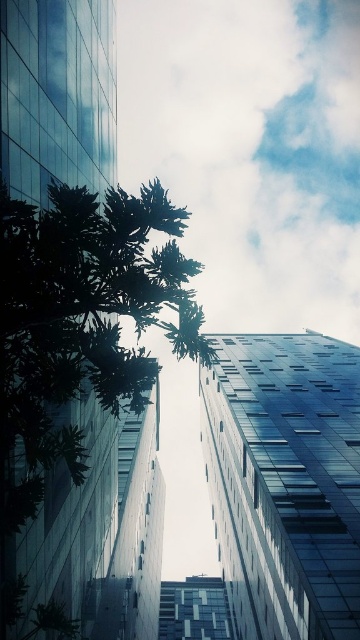
Who is shorter, white fluffy cloud at upper center or green leafy tree at center?

green leafy tree at center is shorter.

Between white fluffy cloud at upper center and green leafy tree at center, which one appears on the left side from the viewer's perspective?

From the viewer's perspective, green leafy tree at center appears more on the left side.

Identify the location of white fluffy cloud at upper center. The height and width of the screenshot is (640, 360). (250, 148).